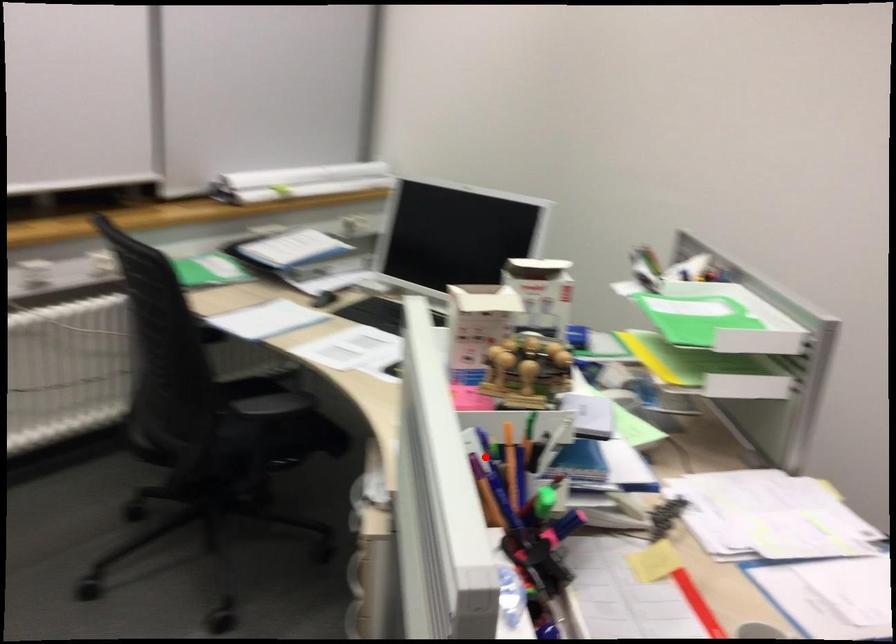
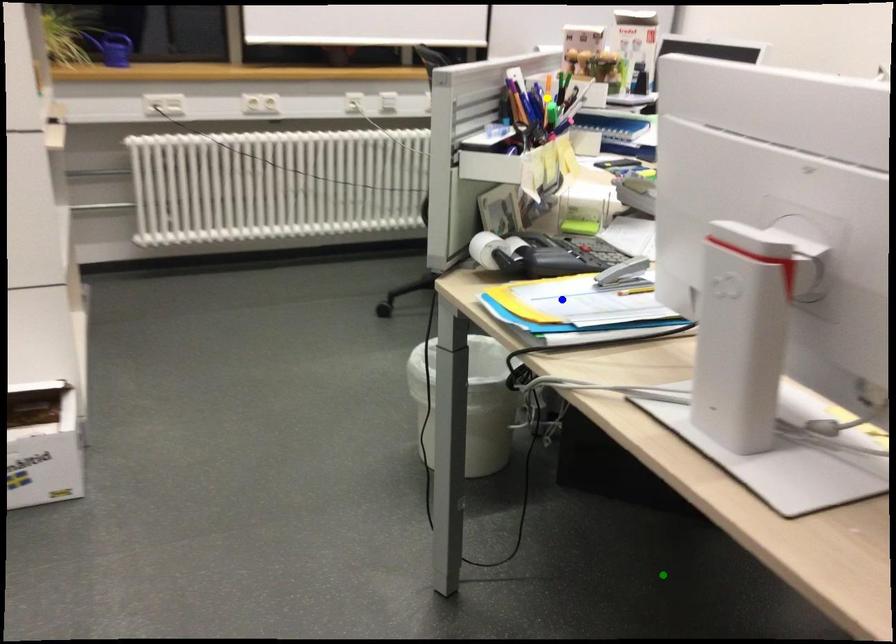
Question: I am providing you with two images of the same scene from different viewpoints. A red point is marked on the first image. You are given multiple points on the second image. Which point in image 2 is actually the same real-world point as the red point in image 1?

Choices:
 (A) blue point
 (B) yellow point
 (C) green point

Answer: (B)